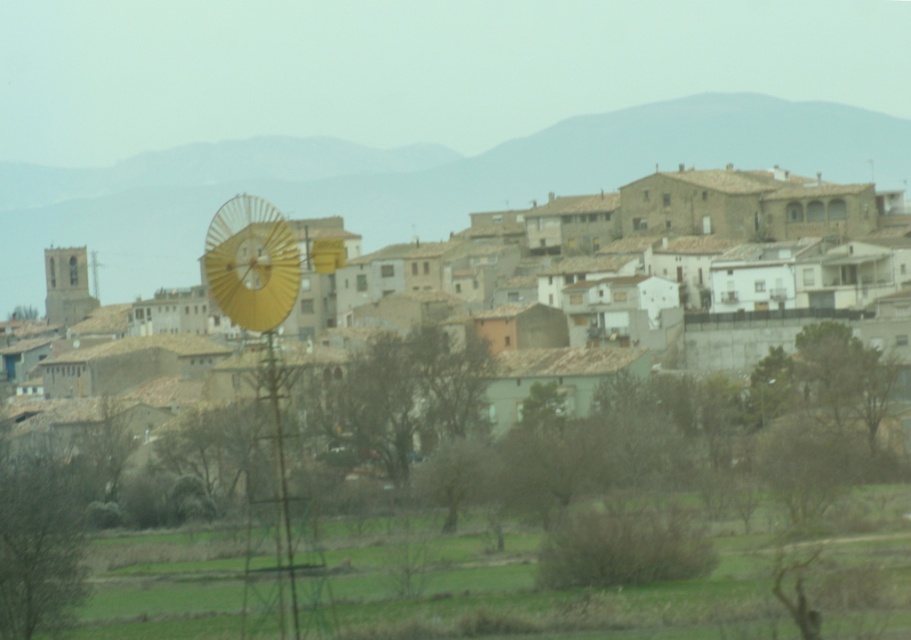
Question: Is green grass at lower center bigger than metallic yellow windmill at center-left?

Choices:
 (A) yes
 (B) no

Answer: (A)

Question: Which object is positioned farthest from the metallic yellow windmill at center-left?

Choices:
 (A) gold metallic windmill at center
 (B) green grass at lower center

Answer: (A)

Question: Among these objects, which one is nearest to the camera?

Choices:
 (A) green grass at lower center
 (B) metallic yellow windmill at center-left
 (C) gold metallic windmill at center

Answer: (A)

Question: Which point is closer to the camera?

Choices:
 (A) (254, 289)
 (B) (776, 212)

Answer: (A)

Question: Does green grass at lower center appear on the right side of gold metallic windmill at center?

Choices:
 (A) yes
 (B) no

Answer: (A)

Question: Does gold metallic windmill at center appear over metallic yellow windmill at center-left?

Choices:
 (A) yes
 (B) no

Answer: (A)